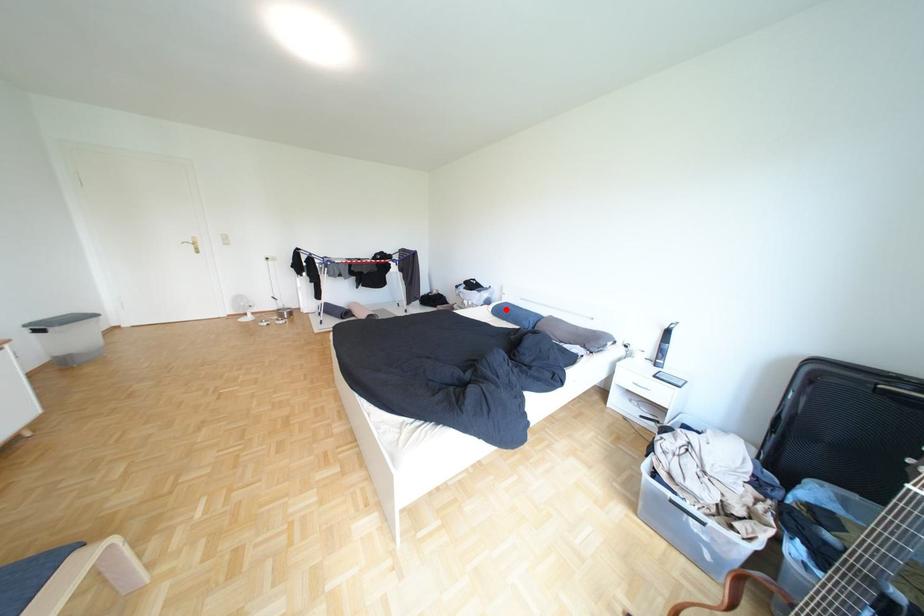
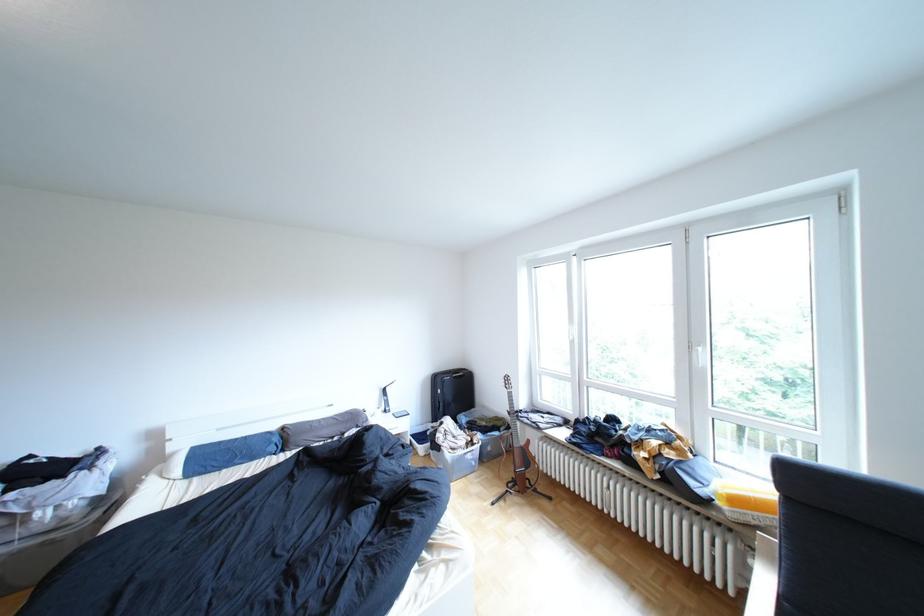
The point at the highlighted location is marked in the first image. Where is the corresponding point in the second image?

(193, 472)